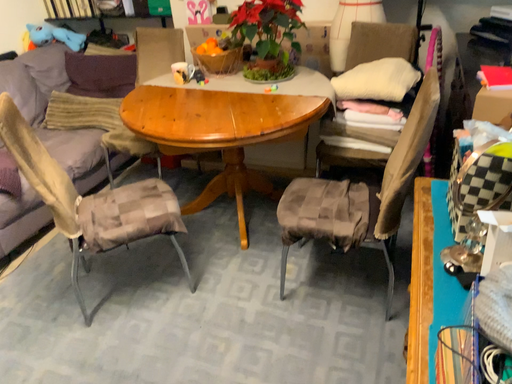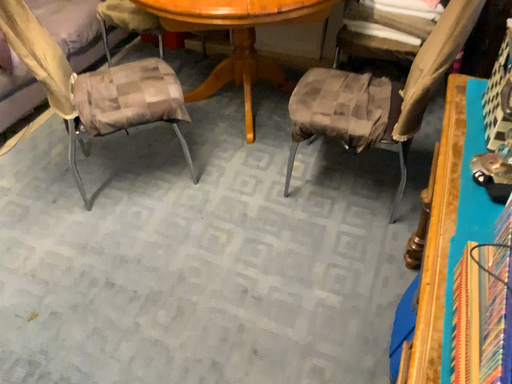
Question: How did the camera likely rotate when shooting the video?

Choices:
 (A) rotated downward
 (B) rotated upward

Answer: (A)